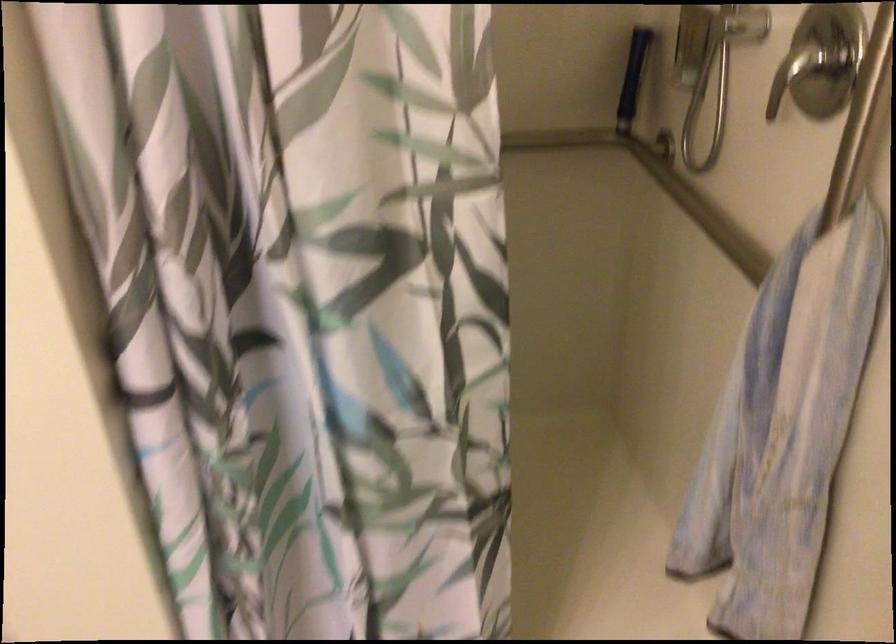
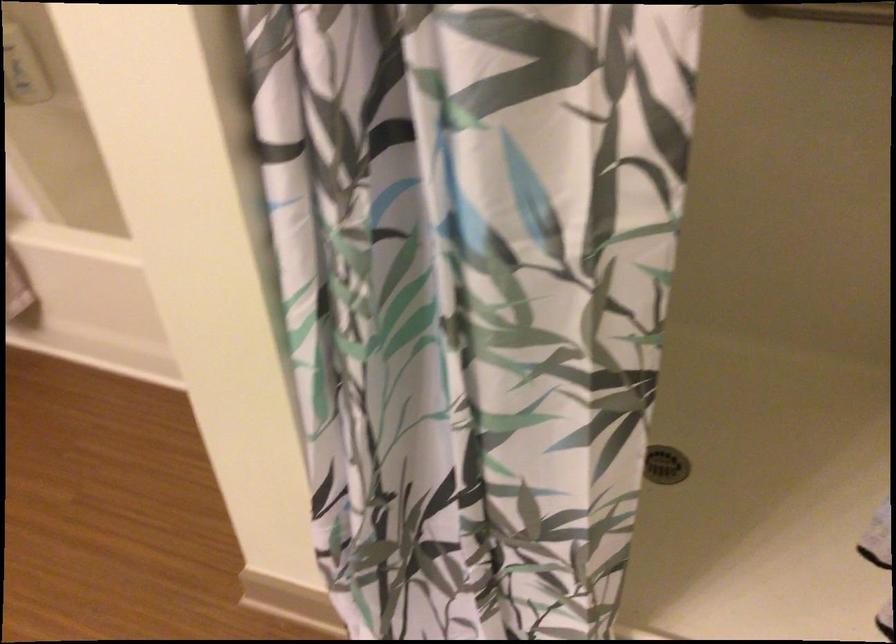
Question: The images are taken continuously from a first-person perspective. In which direction is your viewpoint rotating?

Choices:
 (A) Left
 (B) Right
 (C) Up
 (D) Down

Answer: (A)